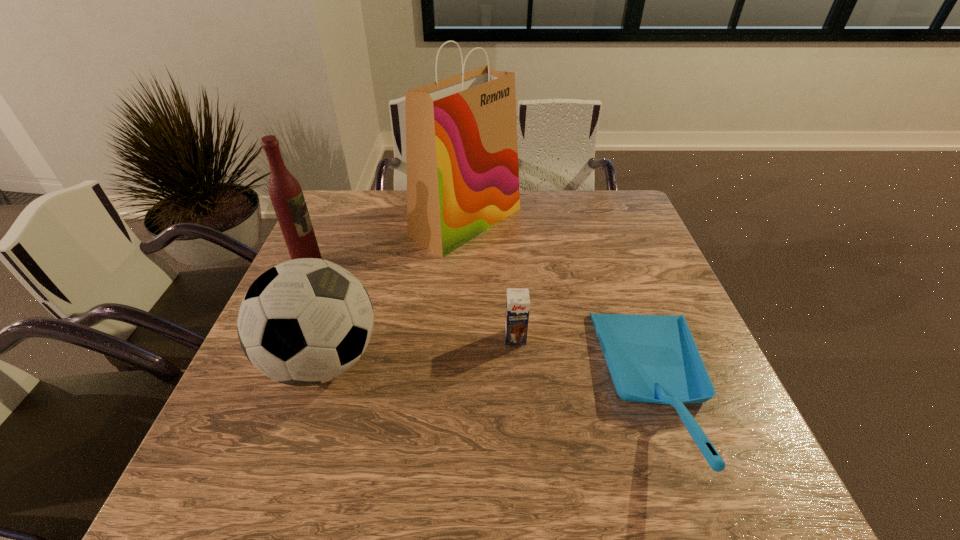
Image resolution: width=960 pixels, height=540 pixels. In order to click on vacant space located on the front label of the chocolate milk in this screenshot , I will do `click(526, 470)`.

This screenshot has width=960, height=540. Identify the location of vacant space located on the back of the dustpan. (603, 230).

Where is `object located in the far edge section of the desktop`? The image size is (960, 540). object located in the far edge section of the desktop is located at coordinates (461, 132).

Identify the location of object present at the near edge. (651, 358).

Locate an element on the screen. Image resolution: width=960 pixels, height=540 pixels. liquor located at the left edge is located at coordinates (285, 192).

Where is `soccer ball situated at the left edge`? soccer ball situated at the left edge is located at coordinates (306, 321).

Identify the location of object that is at the right edge. The height and width of the screenshot is (540, 960). (651, 358).

In order to click on object that is at the near right corner in this screenshot , I will do `click(651, 358)`.

The width and height of the screenshot is (960, 540). In the image, there is a desktop. In order to click on free region at the far edge in this screenshot , I will do `click(568, 211)`.

Locate an element on the screen. This screenshot has height=540, width=960. free region at the near edge is located at coordinates (594, 459).